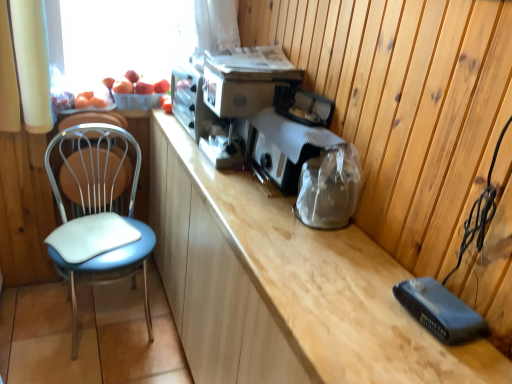
Question: Can you confirm if metallic silver toaster at center, the second appliance positioned from the front, is bigger than wooden cabinet at center?

Choices:
 (A) no
 (B) yes

Answer: (A)

Question: Would you say metallic silver toaster at center, which is counted as the first appliance, starting from the back, contains wooden cabinet at center?

Choices:
 (A) yes
 (B) no

Answer: (B)

Question: Can you confirm if metallic silver toaster at center, which is counted as the first appliance, starting from the back, is thinner than wooden cabinet at center?

Choices:
 (A) no
 (B) yes

Answer: (A)

Question: From the image's perspective, is metallic silver toaster at center, the second appliance positioned from the front, under wooden cabinet at center?

Choices:
 (A) yes
 (B) no

Answer: (B)

Question: Is metallic silver toaster at center, which is counted as the first appliance, starting from the back, taller than wooden cabinet at center?

Choices:
 (A) yes
 (B) no

Answer: (B)

Question: Considering their positions, is metallic silver toaster at center, the second appliance positioned from the front, located in front of or behind matte black toaster at center, the 2th appliance in the back-to-front sequence?

Choices:
 (A) front
 (B) behind

Answer: (B)

Question: Based on their sizes in the image, would you say metallic silver toaster at center, which is counted as the first appliance, starting from the back, is bigger or smaller than matte black toaster at center, the 2th appliance in the back-to-front sequence?

Choices:
 (A) big
 (B) small

Answer: (A)

Question: Visually, is metallic silver toaster at center, the second appliance positioned from the front, positioned to the left or to the right of matte black toaster at center, which is counted as the first appliance, starting from the front?

Choices:
 (A) right
 (B) left

Answer: (B)

Question: Considering the positions of metallic silver toaster at center, which is counted as the first appliance, starting from the back, and matte black toaster at center, the 2th appliance in the back-to-front sequence, in the image, is metallic silver toaster at center, which is counted as the first appliance, starting from the back, wider or thinner than matte black toaster at center, the 2th appliance in the back-to-front sequence,?

Choices:
 (A) wide
 (B) thin

Answer: (A)

Question: In the image, is matte black toaster at center, which is counted as the first appliance, starting from the front, on the left side or the right side of blue leatherette chair at left?

Choices:
 (A) left
 (B) right

Answer: (B)

Question: Considering the positions of matte black toaster at center, the 2th appliance in the back-to-front sequence, and blue leatherette chair at left in the image, is matte black toaster at center, the 2th appliance in the back-to-front sequence, wider or thinner than blue leatherette chair at left?

Choices:
 (A) wide
 (B) thin

Answer: (B)

Question: From the image's perspective, is matte black toaster at center, the 2th appliance in the back-to-front sequence, above or below blue leatherette chair at left?

Choices:
 (A) below
 (B) above

Answer: (B)

Question: Is point (293, 122) positioned closer to the camera than point (69, 269)?

Choices:
 (A) closer
 (B) farther

Answer: (A)

Question: In the image, is wooden cabinet at center on the left side or the right side of matte black toaster at center, which is counted as the first appliance, starting from the front?

Choices:
 (A) left
 (B) right

Answer: (A)

Question: From the image's perspective, is wooden cabinet at center positioned above or below matte black toaster at center, the 2th appliance in the back-to-front sequence?

Choices:
 (A) above
 (B) below

Answer: (B)